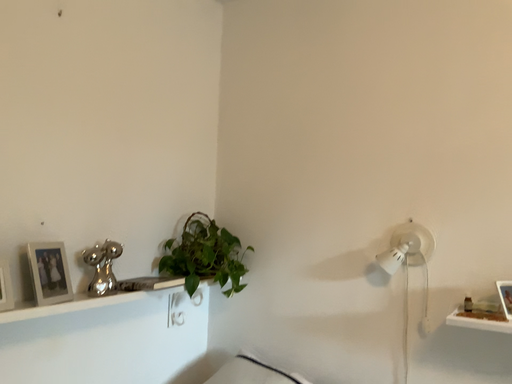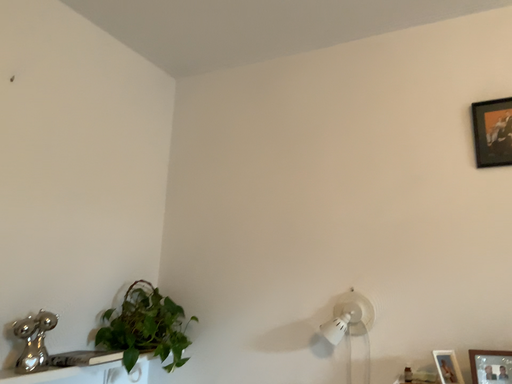
Question: Which way did the camera rotate in the video?

Choices:
 (A) rotated right
 (B) rotated left

Answer: (A)